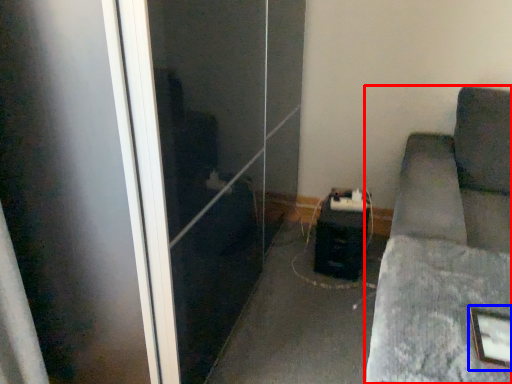
Question: Among these objects, which one is nearest to the camera, furniture (highlighted by a red box) or picture frame (highlighted by a blue box)?

Choices:
 (A) furniture
 (B) picture frame

Answer: (A)